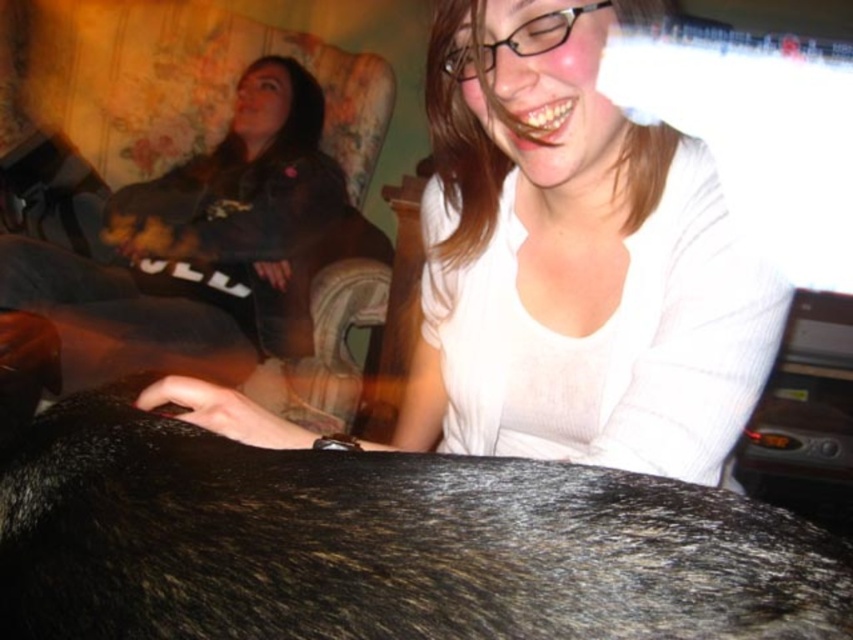
Who is more forward, (494, 580) or (311, 97)?

Point (494, 580) is in front.

Locate an element on the screen. The width and height of the screenshot is (853, 640). shiny black fur at center is located at coordinates (381, 544).

Where is `shiny black fur at center`? This screenshot has width=853, height=640. shiny black fur at center is located at coordinates (381, 544).

You are a GUI agent. You are given a task and a screenshot of the screen. Output one action in this format:
    pyautogui.click(x=<x>, y=<y>)
    Task: Click on the shiny black fur at center
    The image size is (853, 640).
    Given the screenshot: What is the action you would take?
    [x=381, y=544]

What do you see at coordinates (381, 544) in the screenshot? I see `shiny black fur at center` at bounding box center [381, 544].

Who is lower down, shiny black fur at center or white ribbed shirt at center?

shiny black fur at center is below.

Between point (222, 445) and point (428, 212), which one is positioned behind?

Point (428, 212)

I want to click on shiny black fur at center, so click(x=381, y=544).

Does point (718, 202) lie behind point (297, 236)?

No, it is in front of (297, 236).

Is white ribbed shirt at center to the right of dark gray hoodie at upper left from the viewer's perspective?

Yes, white ribbed shirt at center is to the right of dark gray hoodie at upper left.

Does point (466, 40) lie behind point (74, 360)?

No, (466, 40) is closer to viewer.

Where is `white ribbed shirt at center`? The image size is (853, 640). white ribbed shirt at center is located at coordinates (573, 260).